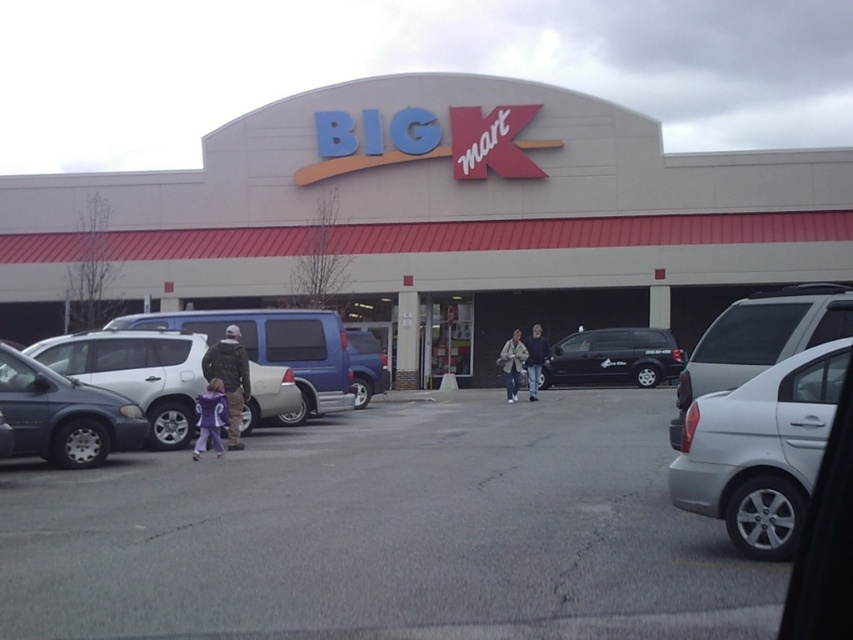
Does matte white suv at left appear on the right side of dark blue jeans at center?

In fact, matte white suv at left is to the left of dark blue jeans at center.

Is matte white suv at left below dark blue jeans at center?

Yes.

Who is more forward, (296, 388) or (529, 337)?

Point (296, 388)

Where is `matte white suv at left`? The image size is (853, 640). matte white suv at left is located at coordinates (136, 372).

Is gray asphalt parking lot at center thinner than matte white suv at center-left?

In fact, gray asphalt parking lot at center might be wider than matte white suv at center-left.

Between gray asphalt parking lot at center and matte white suv at center-left, which one is positioned lower?

Positioned lower is gray asphalt parking lot at center.

Is point (15, 589) positioned behind point (322, 390)?

No, it is not.

You are a GUI agent. You are given a task and a screenshot of the screen. Output one action in this format:
    pyautogui.click(x=<x>, y=<y>)
    Task: Click on the gray asphalt parking lot at center
    This screenshot has height=640, width=853.
    Given the screenshot: What is the action you would take?
    click(386, 534)

Is point (538, 628) behind point (194, 449)?

That is False.

Locate an element on the screen. gray asphalt parking lot at center is located at coordinates (386, 534).